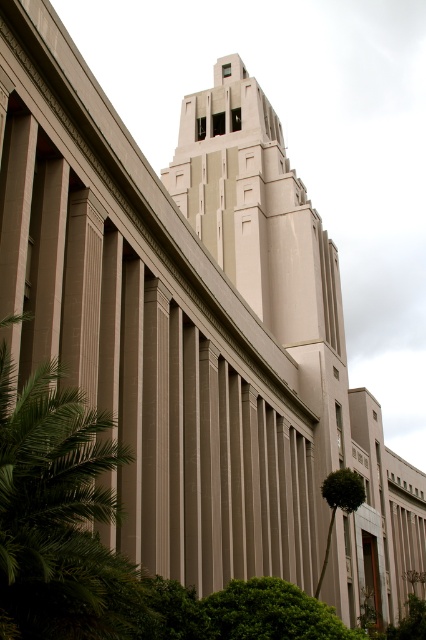
Question: Can you confirm if green leafy palm tree at left is positioned to the right of green leafy palm tree at lower right?

Choices:
 (A) yes
 (B) no

Answer: (B)

Question: Is green leafy palm tree at left positioned in front of green leafy palm tree at lower right?

Choices:
 (A) no
 (B) yes

Answer: (B)

Question: Which of the following is the closest to the observer?

Choices:
 (A) (71, 548)
 (B) (354, 474)

Answer: (A)

Question: Is green leafy palm tree at left to the right of green leafy palm tree at lower right from the viewer's perspective?

Choices:
 (A) no
 (B) yes

Answer: (A)

Question: Which point is closer to the camera taking this photo?

Choices:
 (A) (2, 365)
 (B) (325, 486)

Answer: (A)